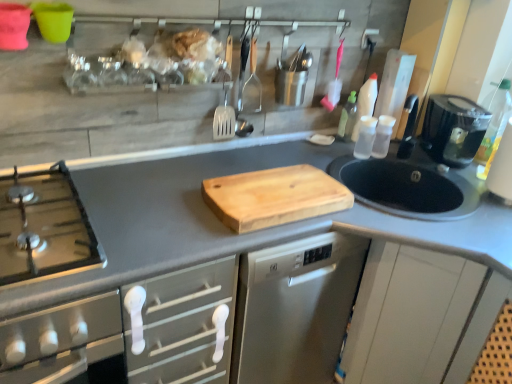
Question: From the image's perspective, is transparent plastic bottle at right, the third bottle viewed from the left, on transparent plastic bottles at right, placed as the second bottle when sorted from left to right?

Choices:
 (A) yes
 (B) no

Answer: (A)

Question: Considering the relative positions of transparent plastic bottle at right, the first bottle positioned from the right, and transparent plastic bottles at right, the 2th bottle viewed from the right, in the image provided, is transparent plastic bottle at right, the first bottle positioned from the right, to the right of transparent plastic bottles at right, the 2th bottle viewed from the right, from the viewer's perspective?

Choices:
 (A) yes
 (B) no

Answer: (A)

Question: From a real-world perspective, is transparent plastic bottle at right, the first bottle positioned from the right, positioned under transparent plastic bottles at right, placed as the second bottle when sorted from left to right, based on gravity?

Choices:
 (A) no
 (B) yes

Answer: (A)

Question: Considering the relative sizes of transparent plastic bottle at right, the first bottle positioned from the right, and transparent plastic bottles at right, placed as the second bottle when sorted from left to right, in the image provided, is transparent plastic bottle at right, the first bottle positioned from the right, bigger than transparent plastic bottles at right, placed as the second bottle when sorted from left to right,?

Choices:
 (A) no
 (B) yes

Answer: (B)

Question: Can you confirm if transparent plastic bottle at right, the first bottle positioned from the right, is shorter than transparent plastic bottles at right, the 2th bottle viewed from the right?

Choices:
 (A) no
 (B) yes

Answer: (A)

Question: Considering the relative positions of transparent plastic bottle at right, the first bottle positioned from the right, and transparent plastic bottle at upper right, which is the first bottle in left-to-right order, in the image provided, is transparent plastic bottle at right, the first bottle positioned from the right, to the left or to the right of transparent plastic bottle at upper right, which is the first bottle in left-to-right order,?

Choices:
 (A) right
 (B) left

Answer: (A)

Question: Looking at their shapes, would you say transparent plastic bottle at right, the third bottle viewed from the left, is wider or thinner than transparent plastic bottle at upper right, which is the first bottle in left-to-right order?

Choices:
 (A) thin
 (B) wide

Answer: (B)

Question: Based on their sizes in the image, would you say transparent plastic bottle at right, the first bottle positioned from the right, is bigger or smaller than transparent plastic bottle at upper right, which is the third bottle in right-to-left order?

Choices:
 (A) big
 (B) small

Answer: (A)

Question: Which is correct: transparent plastic bottle at right, the third bottle viewed from the left, is inside transparent plastic bottle at upper right, which is the first bottle in left-to-right order, or outside of it?

Choices:
 (A) outside
 (B) inside

Answer: (A)

Question: From the image's perspective, is natural wood cutting board at center positioned above or below transparent plastic bottle at right, the first bottle positioned from the right?

Choices:
 (A) below
 (B) above

Answer: (A)

Question: Relative to transparent plastic bottle at right, the first bottle positioned from the right, is natural wood cutting board at center in front or behind?

Choices:
 (A) behind
 (B) front

Answer: (B)

Question: In the image, is natural wood cutting board at center on the left side or the right side of transparent plastic bottle at right, the first bottle positioned from the right?

Choices:
 (A) left
 (B) right

Answer: (A)

Question: Is natural wood cutting board at center bigger or smaller than transparent plastic bottle at right, the first bottle positioned from the right?

Choices:
 (A) big
 (B) small

Answer: (A)

Question: From their relative heights in the image, would you say transparent plastic bottles at right, placed as the second bottle when sorted from left to right, is taller or shorter than transparent plastic bottle at right, the first bottle positioned from the right?

Choices:
 (A) short
 (B) tall

Answer: (A)

Question: Looking at their shapes, would you say transparent plastic bottles at right, the 2th bottle viewed from the right, is wider or thinner than transparent plastic bottle at right, the third bottle viewed from the left?

Choices:
 (A) wide
 (B) thin

Answer: (B)